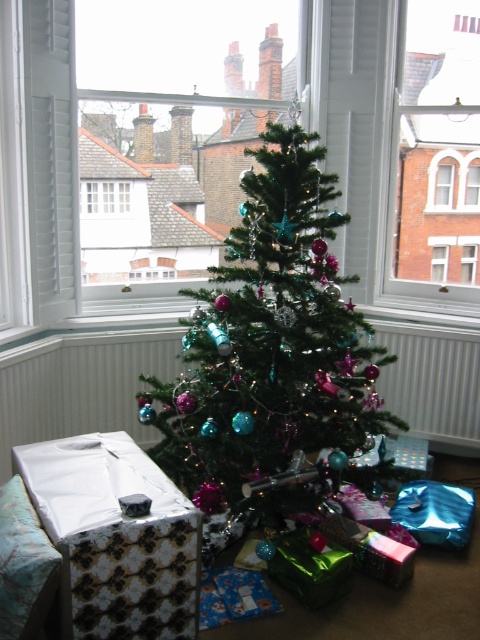
Does clear glass window at center have a larger size compared to green matte christmas tree at center?

Actually, clear glass window at center might be smaller than green matte christmas tree at center.

Based on the photo, does clear glass window at center have a lesser width compared to green matte christmas tree at center?

Yes, clear glass window at center is thinner than green matte christmas tree at center.

Is point (454, 172) less distant than point (133, 144)?

No, (454, 172) is behind (133, 144).

You are a GUI agent. You are given a task and a screenshot of the screen. Output one action in this format:
    pyautogui.click(x=<x>, y=<y>)
    Task: Click on the clear glass window at center
    The height and width of the screenshot is (640, 480).
    Given the screenshot: What is the action you would take?
    pyautogui.click(x=454, y=180)

Does point (120, 145) come closer to viewer compared to point (129, 193)?

Yes.

Does green matte christmas tree at center appear under white wooden window at upper left?

Actually, green matte christmas tree at center is above white wooden window at upper left.

Where is `green matte christmas tree at center`? The height and width of the screenshot is (640, 480). green matte christmas tree at center is located at coordinates (129, 132).

Can you confirm if clear glass window at center is taller than white wooden window at upper left?

Yes, clear glass window at center is taller than white wooden window at upper left.

Is clear glass window at center wider than white wooden window at upper left?

Indeed, clear glass window at center has a greater width compared to white wooden window at upper left.

Which is in front, point (476, 188) or point (95, 186)?

Positioned in front is point (95, 186).

The width and height of the screenshot is (480, 640). In order to click on clear glass window at center in this screenshot , I will do `click(454, 180)`.